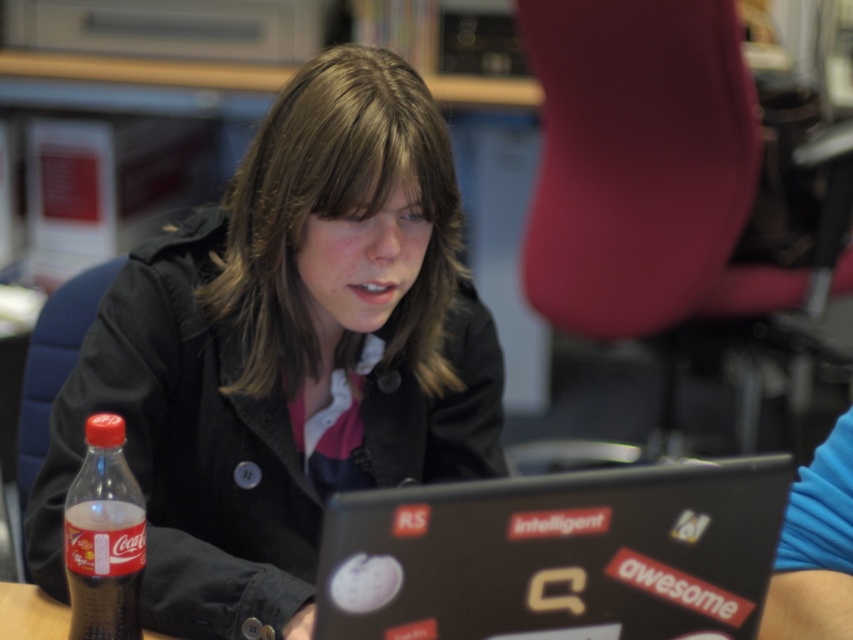
Which is more to the right, translucent plastic bottle at lower left or brown wooden table at lower left?

Positioned to the right is translucent plastic bottle at lower left.

From the picture: Who is more forward, (65, 541) or (21, 588)?

Point (65, 541) is in front.

You are a GUI agent. You are given a task and a screenshot of the screen. Output one action in this format:
    pyautogui.click(x=<x>, y=<y>)
    Task: Click on the translucent plastic bottle at lower left
    Image resolution: width=853 pixels, height=640 pixels.
    Given the screenshot: What is the action you would take?
    pyautogui.click(x=103, y=538)

Which is behind, point (329, 337) or point (405, 566)?

Point (329, 337)

Is black matte jacket at center positioned in front of black matte laptop at center?

No, black matte jacket at center is behind black matte laptop at center.

Between point (305, 632) and point (523, 500), which one is positioned in front?

Point (523, 500) is more forward.

At what (x,y) coordinates should I click in order to perform the action: click on black matte jacket at center. Please return your answer as a coordinate pair (x, y). The height and width of the screenshot is (640, 853). Looking at the image, I should click on point(286,353).

Between black matte jacket at center and translucent plastic bottle at lower left, which one has more height?

black matte jacket at center

Which of these two, black matte jacket at center or translucent plastic bottle at lower left, stands shorter?

translucent plastic bottle at lower left

Locate an element on the screen. black matte jacket at center is located at coordinates (286, 353).

Identify the location of black matte jacket at center. (286, 353).